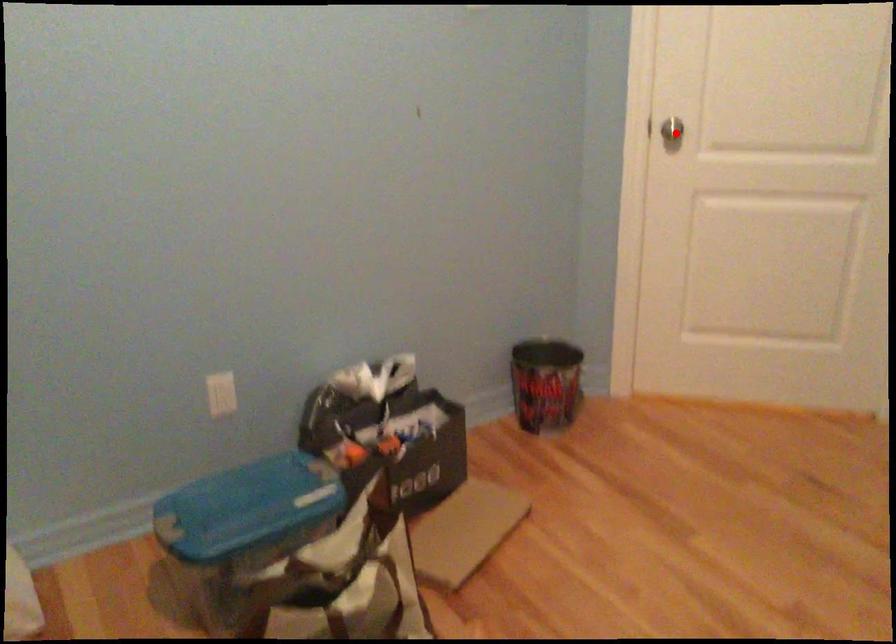
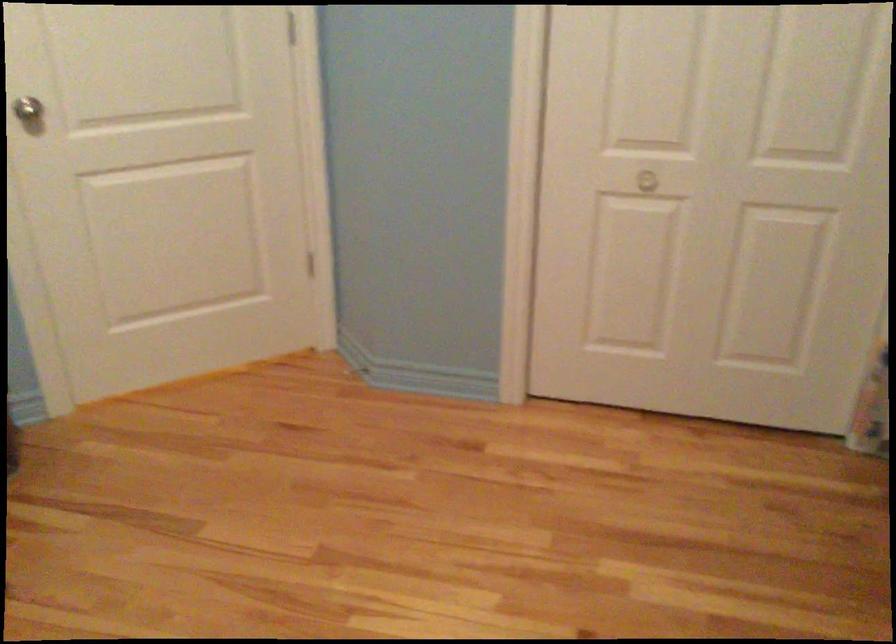
Find the pixel in the second image that matches the highlighted location in the first image.

(29, 111)